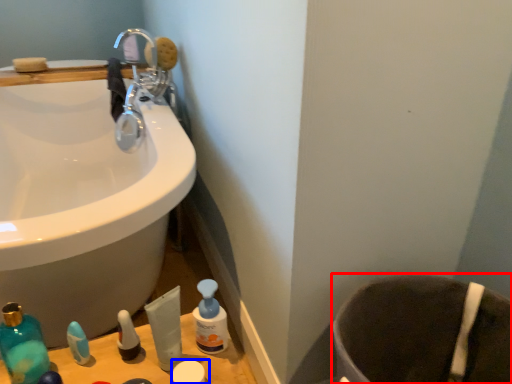
Question: Which of the following is the farthest to the observer, toilet bowl (highlighted by a red box) or toiletry (highlighted by a blue box)?

Choices:
 (A) toilet bowl
 (B) toiletry

Answer: (B)